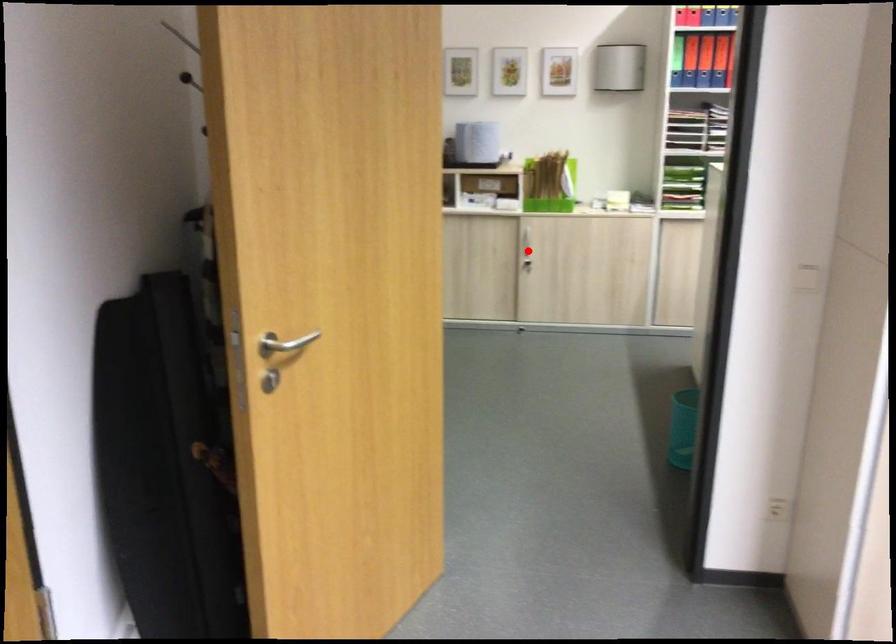
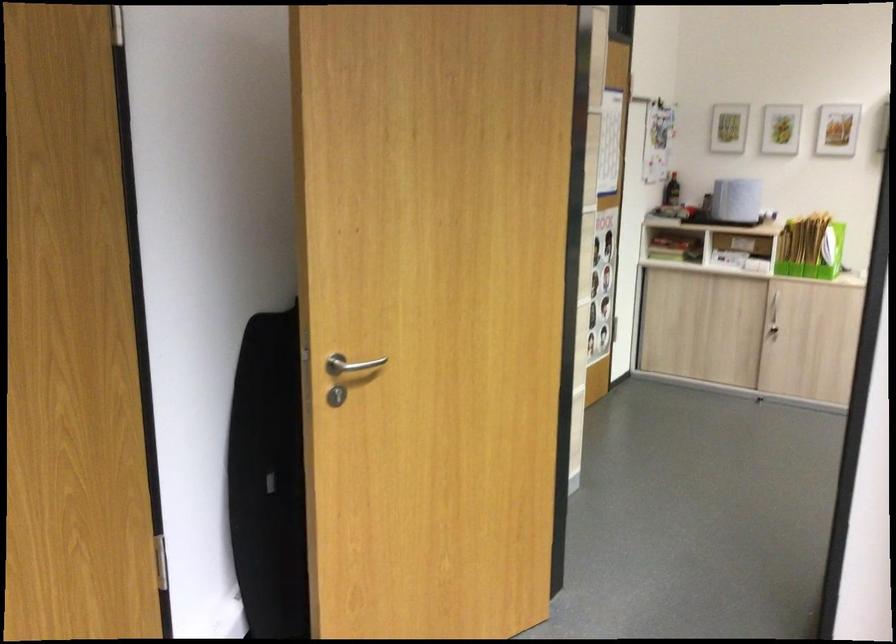
Question: I am providing you with two images of the same scene from different viewpoints. A red point is marked on the first image. Can you still see the location of the red point in image 2?

Choices:
 (A) Yes
 (B) No

Answer: (A)